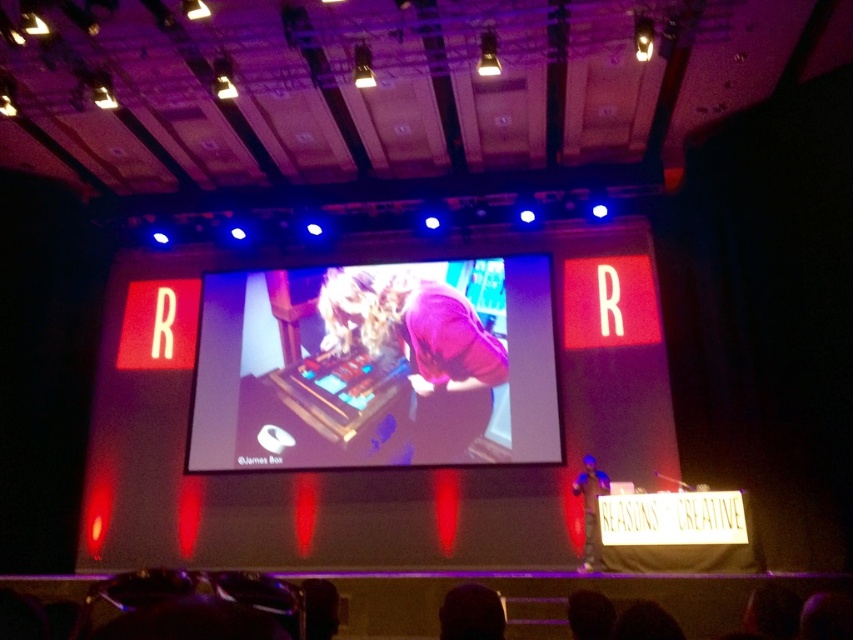
Question: Which object is farther from the camera taking this photo?

Choices:
 (A) matte pink shirt at center
 (B) metallic silver keyboard at center
 (C) purple matte shirt at center
 (D) dark hair at lower center

Answer: (C)

Question: Observing the image, what is the correct spatial positioning of purple matte shirt at center in reference to matte pink shirt at center?

Choices:
 (A) left
 (B) right

Answer: (A)

Question: Does purple matte shirt at center have a greater width compared to matte pink shirt at center?

Choices:
 (A) no
 (B) yes

Answer: (B)

Question: Can you confirm if dark hair at lower center is wider than matte pink shirt at center?

Choices:
 (A) yes
 (B) no

Answer: (B)

Question: Among these objects, which one is nearest to the camera?

Choices:
 (A) purple matte shirt at center
 (B) metallic silver keyboard at center
 (C) matte pink shirt at center
 (D) dark hair at lower center

Answer: (D)

Question: Which object is farther from the camera taking this photo?

Choices:
 (A) dark hair at lower center
 (B) matte pink shirt at center
 (C) metallic silver keyboard at center
 (D) purple matte shirt at center

Answer: (D)